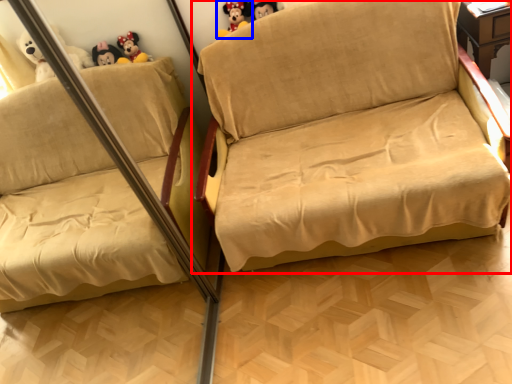
Question: Which object is further to the camera taking this photo, studio couch (highlighted by a red box) or toy (highlighted by a blue box)?

Choices:
 (A) studio couch
 (B) toy

Answer: (B)